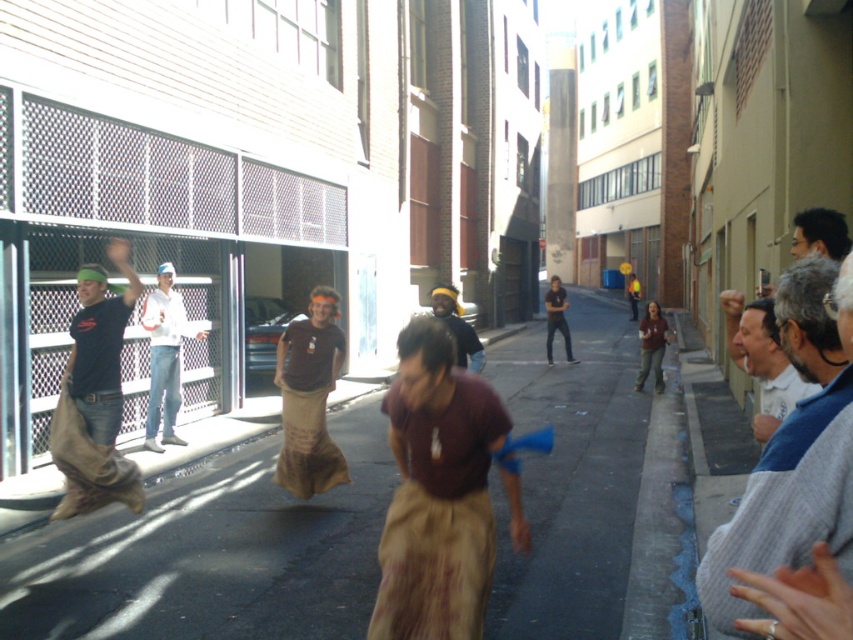
You are a photographer trying to capture the sack race participants. You notice the white cotton shirt at left and the dark brown fabric pants at center. Which object should you focus on to ensure it takes up more space in your photo?

The dark brown fabric pants at center should be focused on because it occupies more space than the white cotton shirt at left.

You are standing at the point labeled point (469, 348). You want to throw a ball to a friend who is standing 6.86 meters away from you. Is this distance within the range of a standard basketball throw?

The distance between you and your friend is 6.86 meters. A standard basketball throw has a range of about 5 to 7 meters, so yes, the distance is within the range of a standard basketball throw.

You are a photographer trying to capture a candid shot of the participants in the sack race. You notice two items of clothing at the center of the image. Which clothing item is positioned higher on the person, the dark brown fabric pants at center or the brown cotton shirt at center?

The dark brown fabric pants at center are positioned higher on the person than the brown cotton shirt at center because the pants are much taller than the shirt.